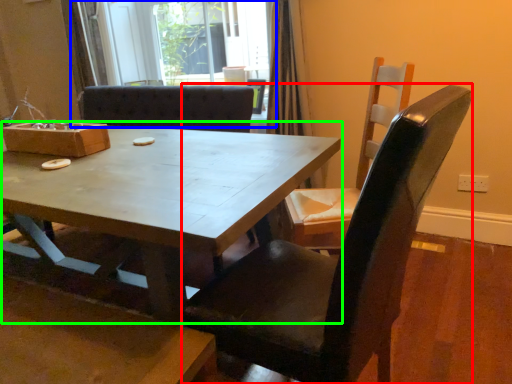
Question: Which object is positioned closest to chair (highlighted by a red box)? Select from glass door (highlighted by a blue box) and coffee table (highlighted by a green box).

Choices:
 (A) glass door
 (B) coffee table

Answer: (B)